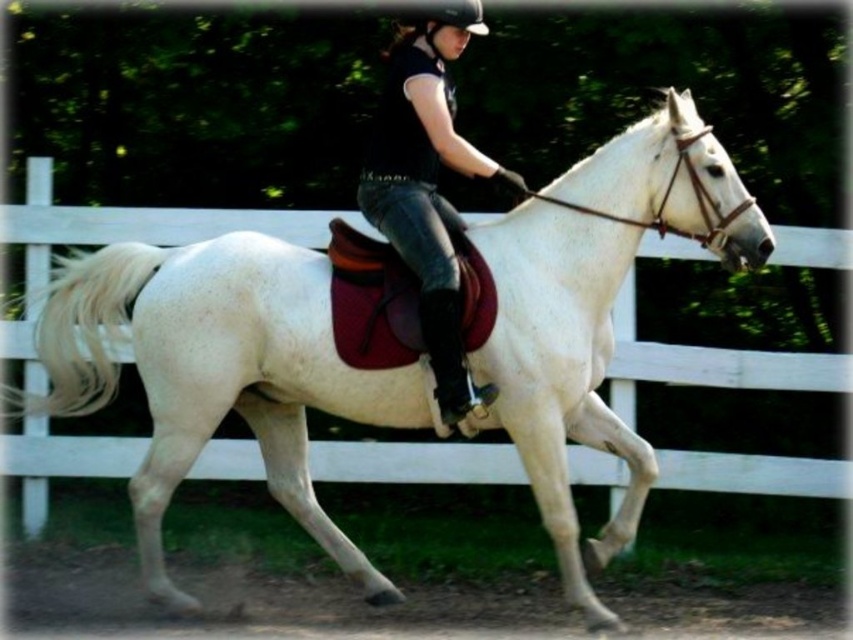
Can you confirm if black matte shirt at center is thinner than black hard helmet at upper center?

No, black matte shirt at center is not thinner than black hard helmet at upper center.

Who is more distant from viewer, (383, 195) or (473, 22)?

The point (473, 22) is behind.

Where is `black matte shirt at center`? The height and width of the screenshot is (640, 853). black matte shirt at center is located at coordinates (428, 188).